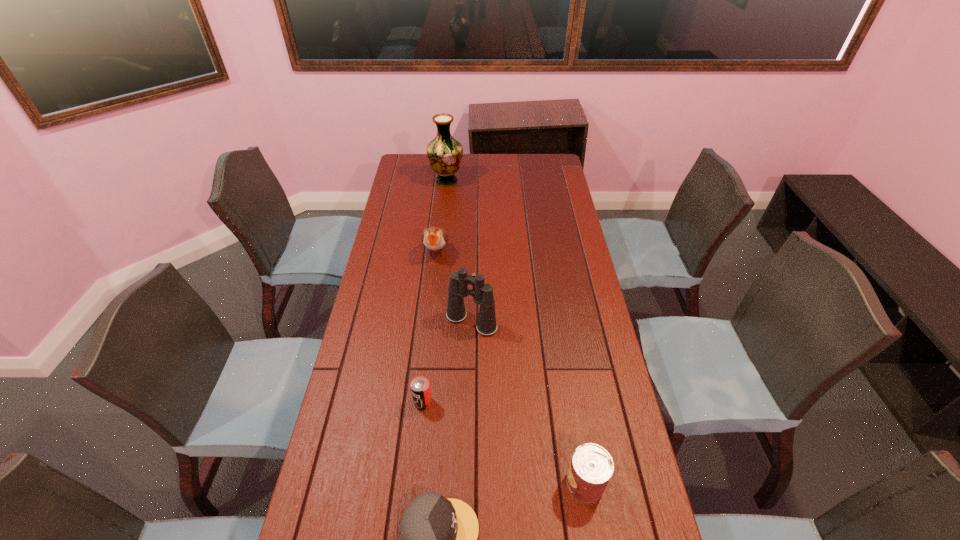
This screenshot has width=960, height=540. I want to click on vacant space at the left edge, so click(406, 207).

The image size is (960, 540). I want to click on vacant space at the right edge, so click(611, 483).

In the image, there is a desktop. Where is `vacant space at the far right corner`? Image resolution: width=960 pixels, height=540 pixels. vacant space at the far right corner is located at coordinates (535, 165).

At what (x,y) coordinates should I click in order to perform the action: click on vacant point located between the fourth farthest object and the fourth shortest object. Please return your answer as a coordinate pair (x, y). Looking at the image, I should click on (429, 327).

Where is `empty space that is in between the farthest object and the taller can`? The width and height of the screenshot is (960, 540). empty space that is in between the farthest object and the taller can is located at coordinates (516, 332).

Find the location of `vacant area that lies between the left can and the vase`. vacant area that lies between the left can and the vase is located at coordinates (435, 292).

I want to click on vacant area that lies between the fifth shortest object and the vase, so tap(459, 252).

I want to click on vacant space that is in between the taller can and the shorter can, so click(504, 443).

This screenshot has height=540, width=960. I want to click on free point between the farthest object and the left can, so click(435, 292).

Identify the location of free space between the fourth farthest object and the right can. (504, 443).